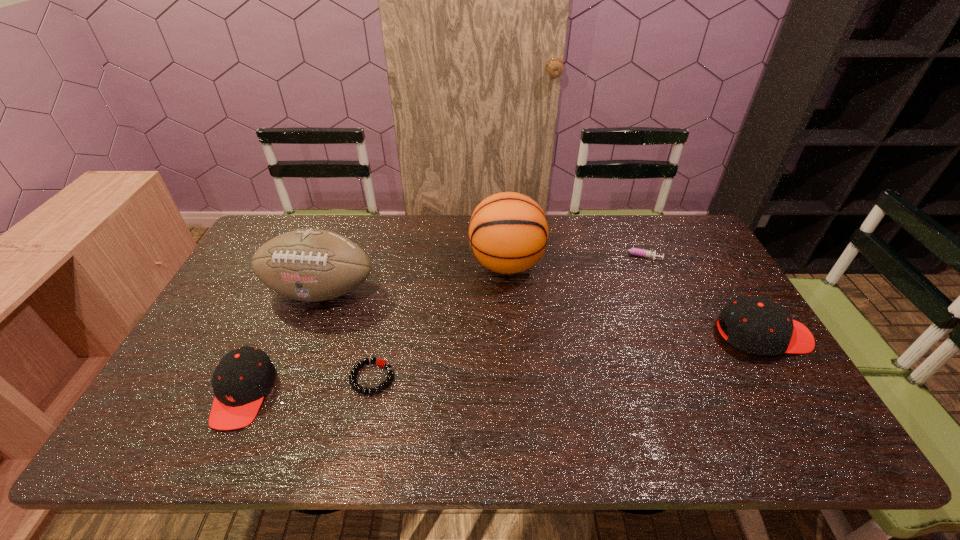
The height and width of the screenshot is (540, 960). I want to click on object that is at the right edge, so click(757, 325).

The width and height of the screenshot is (960, 540). I want to click on object at the near left corner, so click(x=243, y=376).

The image size is (960, 540). I want to click on blank space at the far edge of the desktop, so click(x=450, y=254).

Image resolution: width=960 pixels, height=540 pixels. In the image, there is a desktop. Find the location of `free space at the near edge`. free space at the near edge is located at coordinates (459, 390).

I want to click on free space at the left edge, so click(271, 294).

The height and width of the screenshot is (540, 960). What are the coordinates of `free space at the right edge` in the screenshot? It's located at (720, 361).

This screenshot has width=960, height=540. What are the coordinates of `free space at the far right corner` in the screenshot? It's located at (685, 243).

Locate an element on the screen. free space between the rightmost object and the second object from right to left is located at coordinates (700, 295).

Find the location of a particular element. empty space between the shortest object and the syringe is located at coordinates pyautogui.click(x=504, y=317).

The height and width of the screenshot is (540, 960). Identify the location of vacant point located between the second tallest object and the left cap. (282, 342).